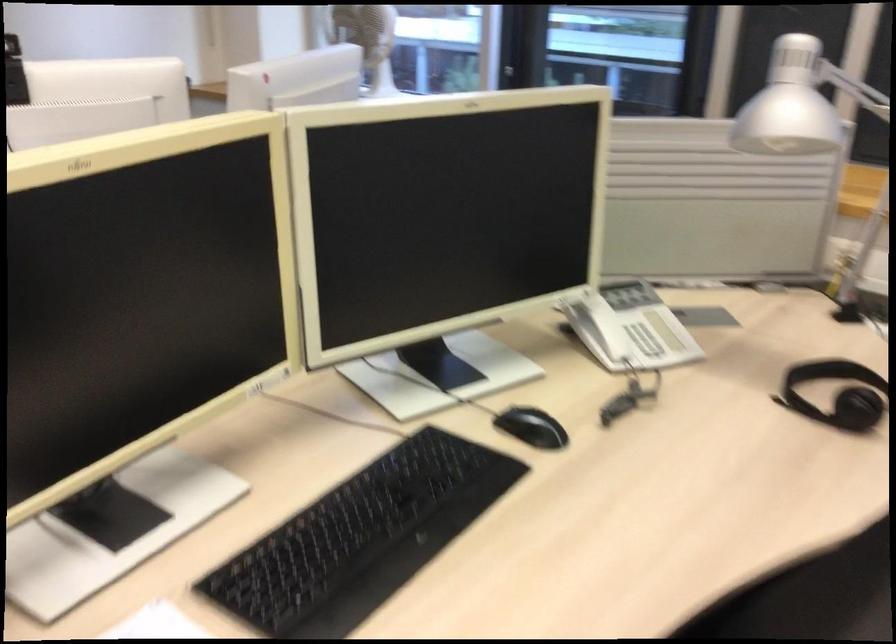
What do you see at coordinates (604, 327) in the screenshot? I see `the telephone handset` at bounding box center [604, 327].